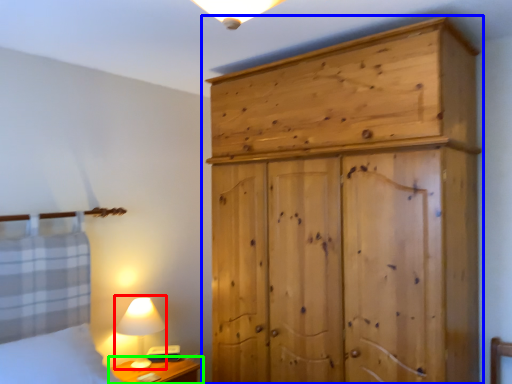
Question: Which object is the farthest from table lamp (highlighted by a red box)? Choose among these: cupboard (highlighted by a blue box) or nightstand (highlighted by a green box).

Choices:
 (A) cupboard
 (B) nightstand

Answer: (A)